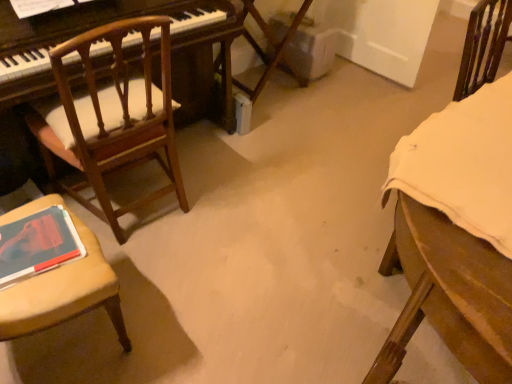
At what (x,y) coordinates should I click in order to perform the action: click on free spot to the right of wooden chair with cushion at left, arranged as the 2th chair when viewed from the right. Please return your answer as a coordinate pair (x, y). The height and width of the screenshot is (384, 512). Looking at the image, I should click on (234, 205).